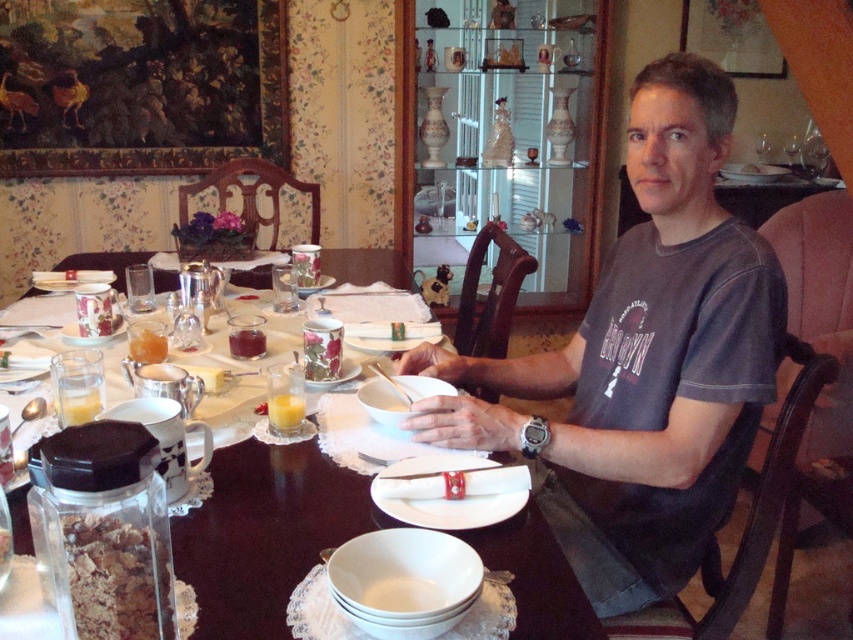
You are a guest at this breakfast table. You want to pour the orange juice from the pitcher into the taller item between the brown crumbly granola at lower left and the white porcelain plate at center. Which object should you choose?

The brown crumbly granola at lower left is taller than the white porcelain plate at center, so you should pour the orange juice into the brown crumbly granola at lower left.

You are a guest at this breakfast table and want to place your teacup on the plate that is taller. Which plate should you choose between the white ceramic plate at upper center and the white porcelain plate at center?

The white ceramic plate at upper center is taller than the white porcelain plate at center, so you should place your teacup on the white ceramic plate at upper center.